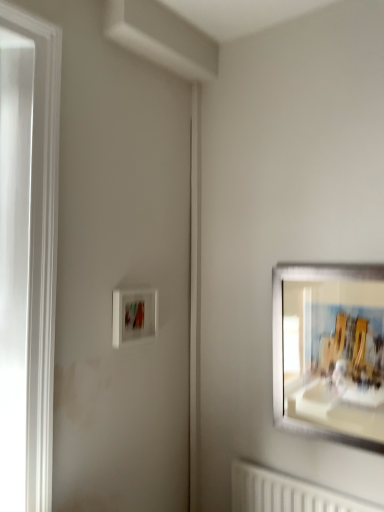
Question: Considering their positions, is white matte picture frame at center-left, arranged as the 2th picture frame when viewed from the right, located in front of or behind matte white picture frame at right, acting as the 1th picture frame starting from the right?

Choices:
 (A) front
 (B) behind

Answer: (B)

Question: Is white matte picture frame at center-left, arranged as the 2th picture frame when viewed from the right, wider or thinner than matte white picture frame at right, the second picture frame viewed from the left?

Choices:
 (A) thin
 (B) wide

Answer: (B)

Question: From a real-world perspective, is white matte picture frame at center-left, arranged as the 2th picture frame when viewed from the right, physically located above or below matte white picture frame at right, acting as the 1th picture frame starting from the right?

Choices:
 (A) below
 (B) above

Answer: (B)

Question: From a real-world perspective, relative to white matte picture frame at center-left, arranged as the 2th picture frame when viewed from the right, is matte white picture frame at right, the second picture frame viewed from the left, vertically above or below?

Choices:
 (A) below
 (B) above

Answer: (A)

Question: Is matte white picture frame at right, acting as the 1th picture frame starting from the right, situated inside white matte picture frame at center-left, which appears as the first picture frame when viewed from the left, or outside?

Choices:
 (A) inside
 (B) outside

Answer: (B)

Question: Does point (297, 359) appear closer or farther from the camera than point (119, 345)?

Choices:
 (A) farther
 (B) closer

Answer: (A)

Question: Is matte white picture frame at right, acting as the 1th picture frame starting from the right, in front of or behind white matte picture frame at center-left, which appears as the first picture frame when viewed from the left, in the image?

Choices:
 (A) behind
 (B) front

Answer: (B)